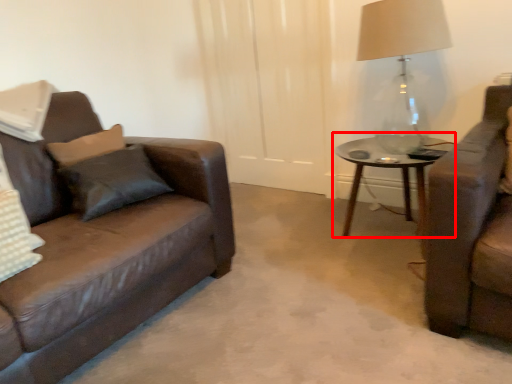
Question: Considering the relative positions of coffee table (annotated by the red box) and table lamp in the image provided, where is coffee table (annotated by the red box) located with respect to the staircase?

Choices:
 (A) left
 (B) right

Answer: (B)